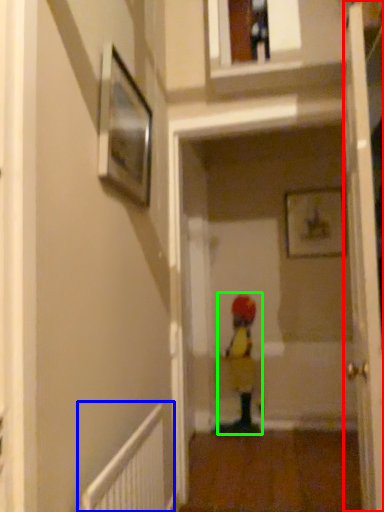
Question: Estimate the real-world distances between objects in this image. Which object is closer to door (highlighted by a red box), radiator (highlighted by a blue box) or toddler (highlighted by a green box)?

Choices:
 (A) radiator
 (B) toddler

Answer: (A)